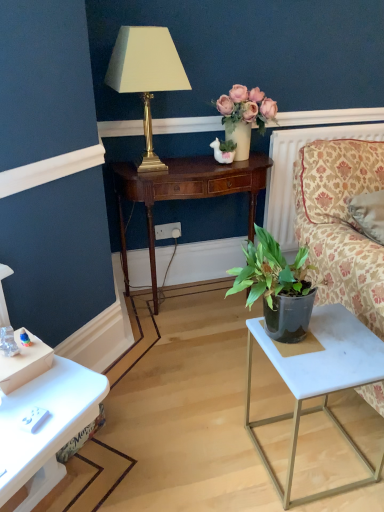
Question: Is floral-patterned fabric couch at right inside matte cream vase at upper center?

Choices:
 (A) yes
 (B) no

Answer: (B)

Question: From the image's perspective, is matte cream vase at upper center located above floral-patterned fabric couch at right?

Choices:
 (A) no
 (B) yes

Answer: (B)

Question: From the image's perspective, would you say matte cream vase at upper center is shown under floral-patterned fabric couch at right?

Choices:
 (A) yes
 (B) no

Answer: (B)

Question: Is matte cream vase at upper center looking in the opposite direction of floral-patterned fabric couch at right?

Choices:
 (A) yes
 (B) no

Answer: (B)

Question: From a real-world perspective, is matte cream vase at upper center positioned over floral-patterned fabric couch at right based on gravity?

Choices:
 (A) yes
 (B) no

Answer: (A)

Question: Is point (304, 361) positioned closer to the camera than point (286, 205)?

Choices:
 (A) farther
 (B) closer

Answer: (B)

Question: Looking at their shapes, would you say white marble side table at lower right is wider or thinner than white textured radiator at upper right?

Choices:
 (A) thin
 (B) wide

Answer: (B)

Question: Is white marble side table at lower right situated inside white textured radiator at upper right or outside?

Choices:
 (A) inside
 (B) outside

Answer: (B)

Question: From a real-world perspective, is white marble side table at lower right above or below white textured radiator at upper right?

Choices:
 (A) above
 (B) below

Answer: (B)

Question: In the image, is mahogany wood table at center positioned in front of or behind white marble side table at lower right?

Choices:
 (A) front
 (B) behind

Answer: (B)

Question: Considering the positions of point (226, 180) and point (288, 358), is point (226, 180) closer or farther from the camera than point (288, 358)?

Choices:
 (A) farther
 (B) closer

Answer: (A)

Question: In terms of width, does mahogany wood table at center look wider or thinner when compared to white marble side table at lower right?

Choices:
 (A) wide
 (B) thin

Answer: (B)

Question: From a real-world perspective, is mahogany wood table at center positioned above or below white marble side table at lower right?

Choices:
 (A) above
 (B) below

Answer: (A)

Question: Considering the positions of white plastic power outlet at center and matte cream vase at upper center in the image, is white plastic power outlet at center taller or shorter than matte cream vase at upper center?

Choices:
 (A) short
 (B) tall

Answer: (A)

Question: From a real-world perspective, is white plastic power outlet at center above or below matte cream vase at upper center?

Choices:
 (A) below
 (B) above

Answer: (A)